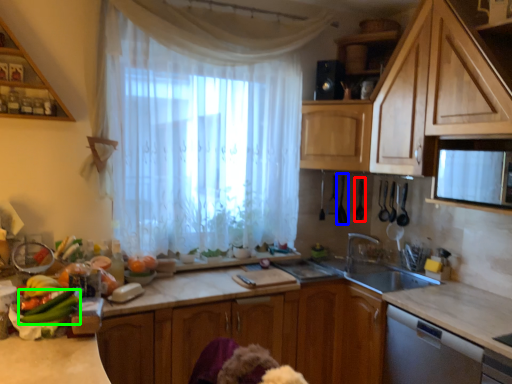
Question: Which object is the closest to the appliance (highlighted by a red box)? Choose among these: appliance (highlighted by a blue box) or vegetable (highlighted by a green box).

Choices:
 (A) appliance
 (B) vegetable

Answer: (A)